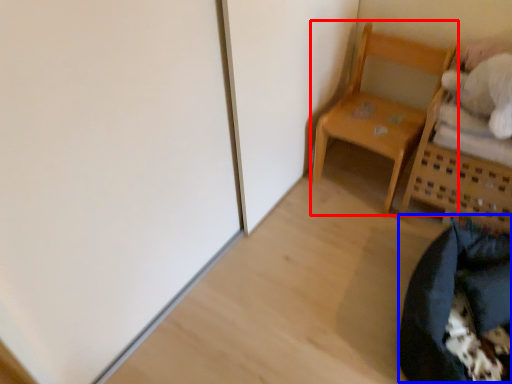
Question: Among these objects, which one is farthest to the camera, furniture (highlighted by a red box) or bean bag chair (highlighted by a blue box)?

Choices:
 (A) furniture
 (B) bean bag chair

Answer: (A)